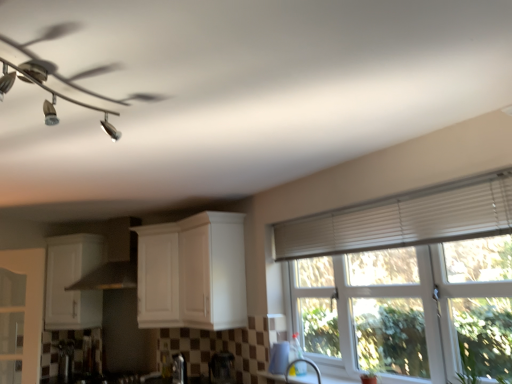
You are a GUI agent. You are given a task and a screenshot of the screen. Output one action in this format:
    pyautogui.click(x=<x>, y=<y>)
    Task: Click on the vacant region above metallic silver ceiling fan at upper left (from a real-world perspective)
    
    Given the screenshot: What is the action you would take?
    pyautogui.click(x=72, y=85)